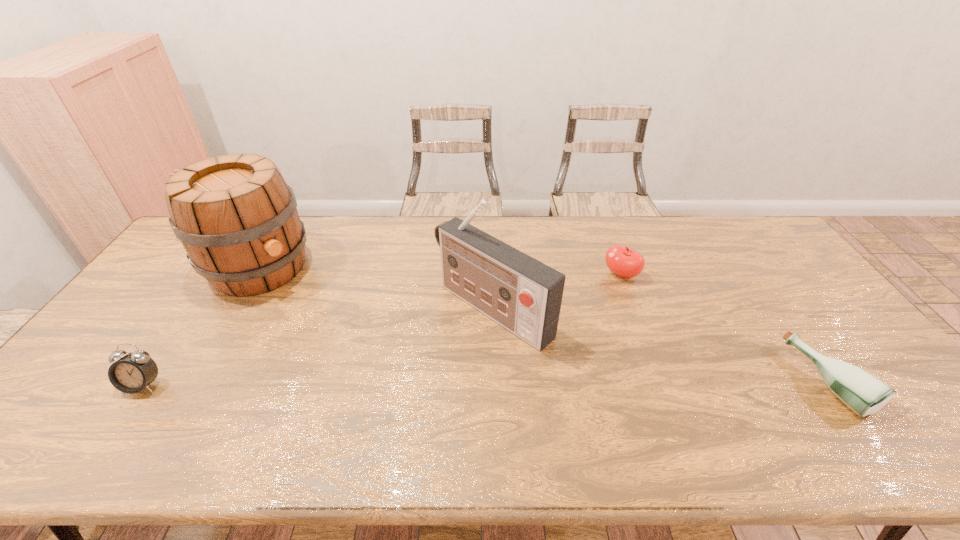
You are a GUI agent. You are given a task and a screenshot of the screen. Output one action in this format:
    pyautogui.click(x=<x>, y=<y>)
    Task: Click on the alarm clock
    Image resolution: width=960 pixels, height=540 pixels.
    Given the screenshot: What is the action you would take?
    pyautogui.click(x=132, y=373)

The height and width of the screenshot is (540, 960). Find the location of `the rightmost object`. the rightmost object is located at coordinates (863, 393).

At what (x,y) coordinates should I click in order to perform the action: click on the shortest object. Please return your answer as a coordinate pair (x, y). The height and width of the screenshot is (540, 960). Looking at the image, I should click on (863, 393).

Locate an element on the screen. This screenshot has height=540, width=960. the fourth object from left to right is located at coordinates (623, 261).

This screenshot has width=960, height=540. In order to click on cider in this screenshot , I will do `click(237, 220)`.

Locate an element on the screen. This screenshot has width=960, height=540. radio receiver is located at coordinates (522, 294).

Locate an element on the screen. blank space located 0.200m on the back of the shortest object is located at coordinates (766, 294).

Find the location of a particular element. vacant space situated 0.200m on the stem of the second object from right to left is located at coordinates (571, 314).

Locate an element on the screen. The image size is (960, 540). free space located 0.230m on the stem of the second object from right to left is located at coordinates (565, 319).

You are a GUI agent. You are given a task and a screenshot of the screen. Output one action in this format:
    pyautogui.click(x=<x>, y=<y>)
    Task: Click on the free location located on the stem of the second object from right to left
    This screenshot has width=960, height=540.
    Given the screenshot: What is the action you would take?
    pyautogui.click(x=567, y=318)